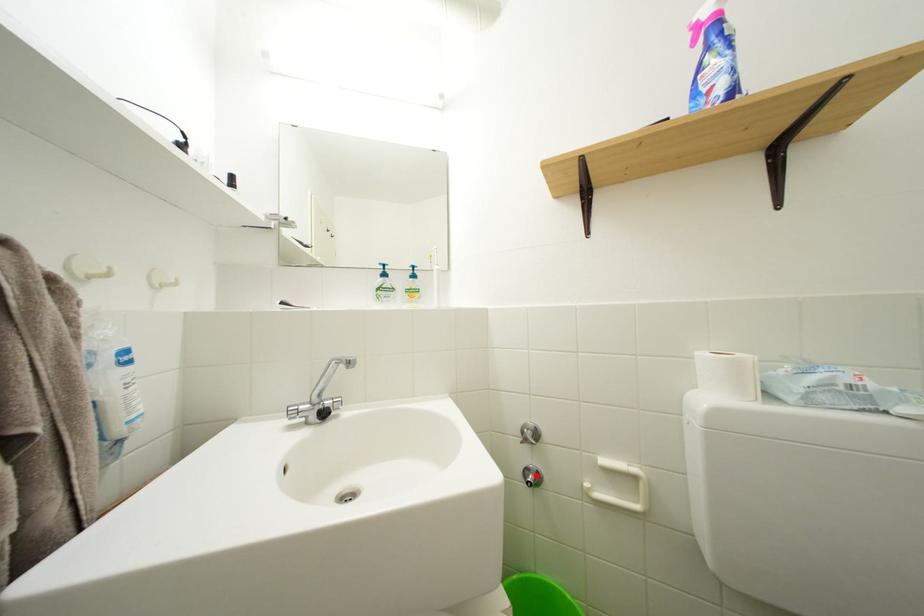
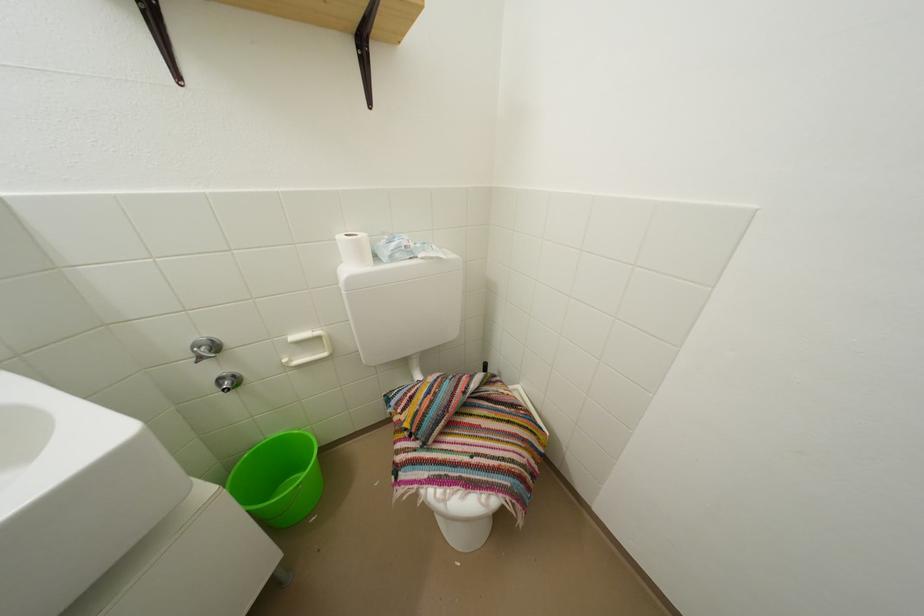
Question: I am providing you with two images of the same scene from different viewpoints. Image1 has a red point marked. In image2, the corresponding 3D location appears at what relative position? Reply with the corresponding letter.

Choices:
 (A) Closer
 (B) Farther

Answer: (A)